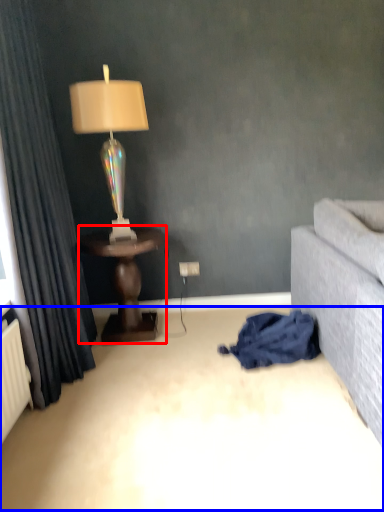
Question: Which point is closer to the camera, table (highlighted by a red box) or plain (highlighted by a blue box)?

Choices:
 (A) table
 (B) plain

Answer: (B)